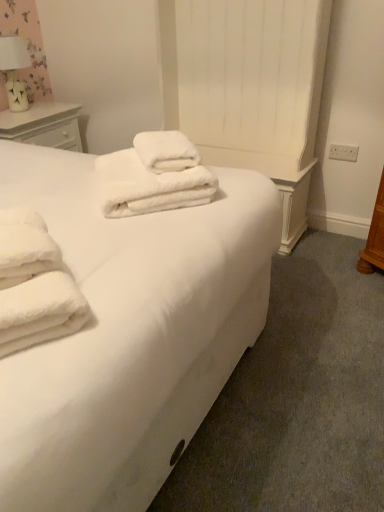
This screenshot has height=512, width=384. Find the location of `white soft towels at center`. white soft towels at center is located at coordinates 129,333.

Does white soft towels at center have a larger size compared to white wood nightstand at upper left?

Yes.

From a real-world perspective, is white soft towels at center physically located above or below white wood nightstand at upper left?

In terms of real-world spatial position, white soft towels at center is above white wood nightstand at upper left.

Is white soft towels at center behind white wood nightstand at upper left?

No, the depth of white soft towels at center is less than that of white wood nightstand at upper left.

How different are the orientations of white soft towels at center and white wood nightstand at upper left in degrees?

There is a 2.21-degree angle between the facing directions of white soft towels at center and white wood nightstand at upper left.

How much distance is there between white ceramic table lamp at upper left and white wood nightstand at upper left?

white ceramic table lamp at upper left and white wood nightstand at upper left are 25.39 centimeters apart from each other.

From the image's perspective, between white ceramic table lamp at upper left and white wood nightstand at upper left, who is located below?

white wood nightstand at upper left appears lower in the image.

Identify the location of table lamp above the white wood nightstand at upper left (from the image's perspective). The image size is (384, 512). tap(14, 70).

Is white ceramic table lamp at upper left facing towards white wood nightstand at upper left?

No, white ceramic table lamp at upper left does not turn towards white wood nightstand at upper left.

Between white wood nightstand at upper left and white ceramic table lamp at upper left, which one appears on the right side from the viewer's perspective?

From the viewer's perspective, white wood nightstand at upper left appears more on the right side.

Is white wood nightstand at upper left inside the boundaries of white ceramic table lamp at upper left, or outside?

The correct answer is: outside.

From the image's perspective, is white wood nightstand at upper left above white ceramic table lamp at upper left?

No, from the image's perspective, white wood nightstand at upper left is not on top of white ceramic table lamp at upper left.

Between white wood nightstand at upper left and white ceramic table lamp at upper left, which one is positioned in front?

white wood nightstand at upper left.

Is point (231, 200) farther from viewer compared to point (112, 213)?

That is True.

From the image's perspective, which one is positioned higher, white soft towels at center or white fluffy towels at center?

white fluffy towels at center is shown above in the image.

Locate an element on the screen. This screenshot has height=512, width=384. bed on the left side of white fluffy towels at center is located at coordinates (129, 333).

Does white soft towels at center lie behind white fluffy towels at center?

No, white soft towels at center is closer to the camera.

Locate an element on the screen. The image size is (384, 512). towel in front of the white wood nightstand at upper left is located at coordinates (148, 185).

Is white fluffy towels at center far away from white wood nightstand at upper left?

Yes, white fluffy towels at center and white wood nightstand at upper left are located far from each other.

From a real-world perspective, which object rests below the other?

In real-world perspective, white wood nightstand at upper left is lower.

Considering the relative positions of white fluffy towels at center and white wood nightstand at upper left in the image provided, is white fluffy towels at center to the right of white wood nightstand at upper left from the viewer's perspective?

Yes.

In the scene shown: Considering the relative sizes of white ceramic table lamp at upper left and white fluffy towels at center in the image provided, is white ceramic table lamp at upper left thinner than white fluffy towels at center?

Yes.

How many degrees apart are the facing directions of white ceramic table lamp at upper left and white fluffy towels at center?

They differ by 50.2 degrees in their facing directions.

Is white ceramic table lamp at upper left closer to camera compared to white fluffy towels at center?

No, it is behind white fluffy towels at center.

Would you say white ceramic table lamp at upper left is a long distance from white fluffy towels at center?

That's right, there is a large distance between white ceramic table lamp at upper left and white fluffy towels at center.

Between white ceramic table lamp at upper left and white soft towels at center, which one has more height?

Standing taller between the two is white soft towels at center.

Which object is further away from the camera taking this photo, white ceramic table lamp at upper left or white soft towels at center?

white ceramic table lamp at upper left is further away from the camera.

Would you say white ceramic table lamp at upper left is outside white soft towels at center?

Yes, white ceramic table lamp at upper left is outside of white soft towels at center.

Considering the relative sizes of white ceramic table lamp at upper left and white soft towels at center in the image provided, is white ceramic table lamp at upper left wider than white soft towels at center?

Incorrect, the width of white ceramic table lamp at upper left does not surpass that of white soft towels at center.

At what (x,y) coordinates should I click in order to perform the action: click on nightstand located above the white soft towels at center (from the image's perspective). Please return your answer as a coordinate pair (x, y). Looking at the image, I should click on (43, 125).

This screenshot has height=512, width=384. I want to click on table lamp that appears behind the white wood nightstand at upper left, so click(x=14, y=70).

Which object lies nearer to the anchor point white soft towels at center, white fluffy towels at center or white ceramic table lamp at upper left?

The object closer to white soft towels at center is white fluffy towels at center.

Considering their positions, is white wood nightstand at upper left positioned further to white soft towels at center than white ceramic table lamp at upper left?

white ceramic table lamp at upper left lies further to white soft towels at center than the other object.

Looking at the image, which one is located closer to white ceramic table lamp at upper left, white fluffy towels at center or white soft towels at center?

white fluffy towels at center lies closer to white ceramic table lamp at upper left than the other object.

Estimate the real-world distances between objects in this image. Which object is further from white ceramic table lamp at upper left, white fluffy towels at center or white wood nightstand at upper left?

The object further to white ceramic table lamp at upper left is white fluffy towels at center.

Based on their spatial positions, is white soft towels at center or white wood nightstand at upper left closer to white ceramic table lamp at upper left?

Based on the image, white wood nightstand at upper left appears to be nearer to white ceramic table lamp at upper left.

From the image, which object appears to be nearer to white fluffy towels at center, white ceramic table lamp at upper left or white soft towels at center?

The object closer to white fluffy towels at center is white soft towels at center.

When comparing their distances from white soft towels at center, does white wood nightstand at upper left or white fluffy towels at center seem closer?

white fluffy towels at center is positioned closer to the anchor white soft towels at center.

Which object lies nearer to the anchor point white soft towels at center, white ceramic table lamp at upper left or white fluffy towels at center?

white fluffy towels at center is closer to white soft towels at center.

Find the location of a particular element. This screenshot has width=384, height=512. towel between white soft towels at center and white ceramic table lamp at upper left in the front-back direction is located at coordinates (148, 185).

Where is `nightstand between white fluffy towels at center and white ceramic table lamp at upper left from front to back`? The width and height of the screenshot is (384, 512). nightstand between white fluffy towels at center and white ceramic table lamp at upper left from front to back is located at coordinates (43, 125).

Locate an element on the screen. towel between white soft towels at center and white wood nightstand at upper left from front to back is located at coordinates (148, 185).

Where is `nightstand between white soft towels at center and white ceramic table lamp at upper left from front to back`? The image size is (384, 512). nightstand between white soft towels at center and white ceramic table lamp at upper left from front to back is located at coordinates (43, 125).